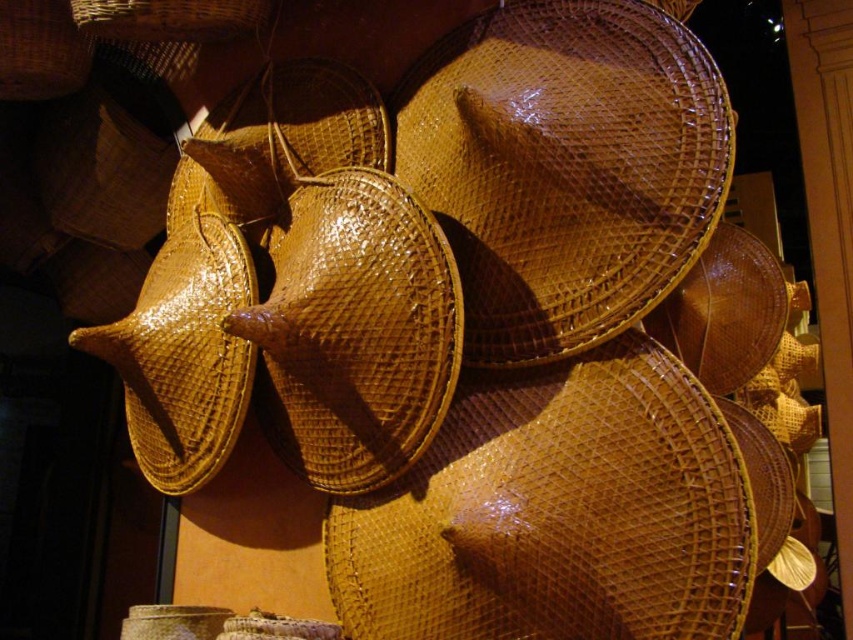
Can you confirm if matte brown woven basket at upper left is taller than woven brown basket at upper left?

Correct, matte brown woven basket at upper left is much taller as woven brown basket at upper left.

Is point (28, 93) positioned behind point (231, 17)?

Yes, it is behind point (231, 17).

Find the location of a particular element. The width and height of the screenshot is (853, 640). matte brown woven basket at upper left is located at coordinates (39, 51).